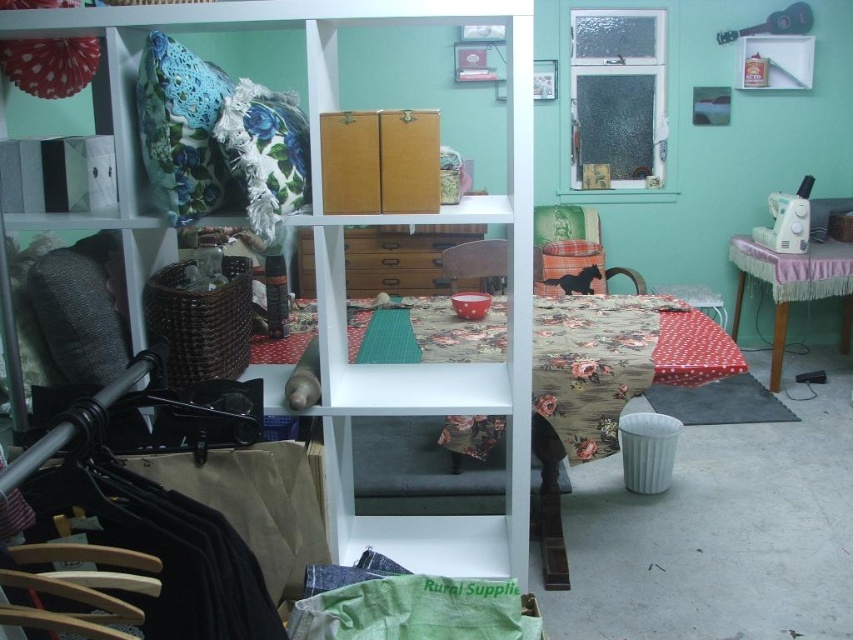
Is point (357, 234) more distant than point (566, 244)?

No, it is in front of (566, 244).

Who is more forward, (355, 243) or (625, 275)?

Positioned in front is point (355, 243).

Identify the location of wooden drawer at center. (399, 257).

Does pink lace-covered sewing machine at right appear under wooden chair at center?

Correct, pink lace-covered sewing machine at right is located below wooden chair at center.

Does pink lace-covered sewing machine at right appear on the left side of wooden chair at center?

In fact, pink lace-covered sewing machine at right is to the right of wooden chair at center.

Measure the distance between pink lace-covered sewing machine at right and camera.

pink lace-covered sewing machine at right is 3.50 meters from camera.

The height and width of the screenshot is (640, 853). Find the location of `pink lace-covered sewing machine at right`. pink lace-covered sewing machine at right is located at coordinates (793, 285).

Is point (422, 374) closer to viewer compared to point (805, 268)?

Yes.

Can you confirm if wooden shelf at center is positioned below pink lace-covered sewing machine at right?

Yes, wooden shelf at center is below pink lace-covered sewing machine at right.

Who is more distant from viewer, (317, 131) or (770, 276)?

Positioned behind is point (770, 276).

This screenshot has height=640, width=853. I want to click on wooden shelf at center, so click(343, 268).